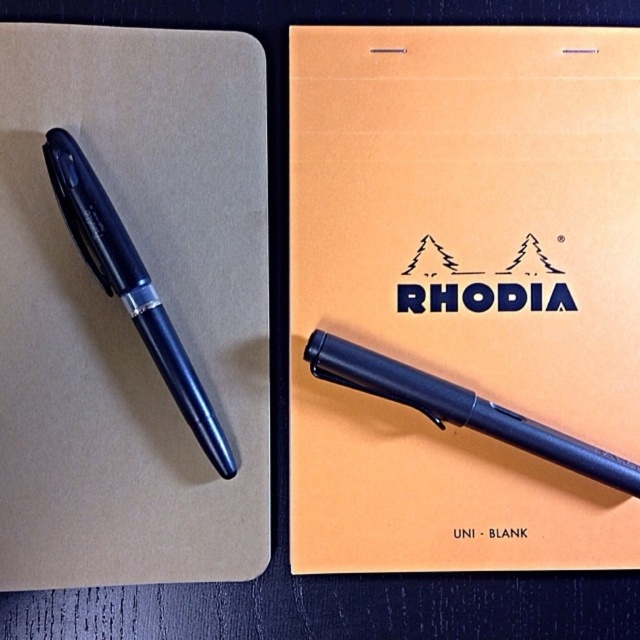
You need to choose a pen for writing a long letter. Considering the size difference between the matte black pen at left and the matte black pen at center, which one would be more comfortable to hold for extended use?

The matte black pen at left is larger in size compared to the matte black pen at center, so it would likely be more comfortable to hold for writing a long letter.

You are trying to determine the spatial relationship between two points in the image. Which point is closer to you, point (35, 241) or point (145, 321)?

Point (35, 241) is closer to the viewer than point (145, 321).